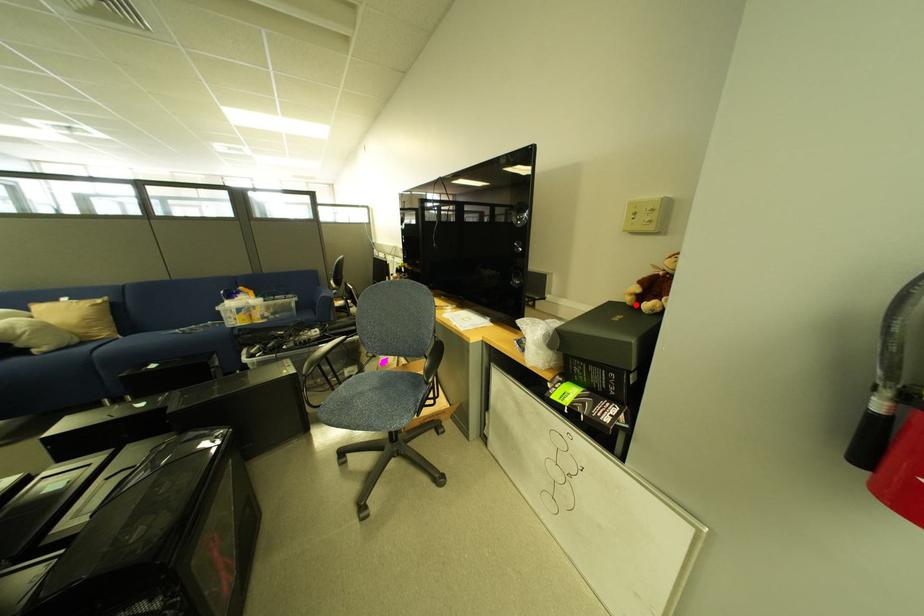
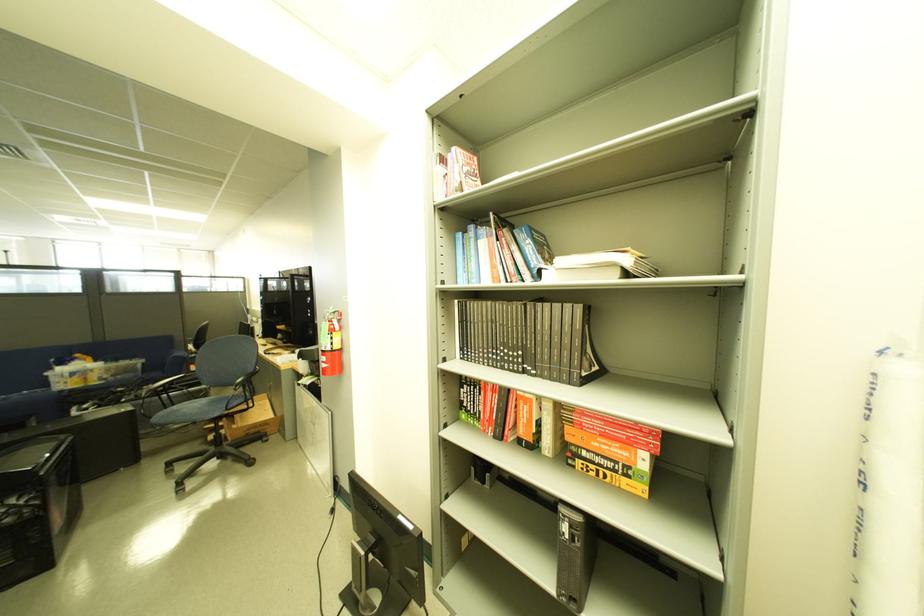
Question: I am providing you with two images of the same scene from different viewpoints. A red point is marked on the first image. Can you still see the location of the red point in image 2?

Choices:
 (A) Yes
 (B) No

Answer: (B)